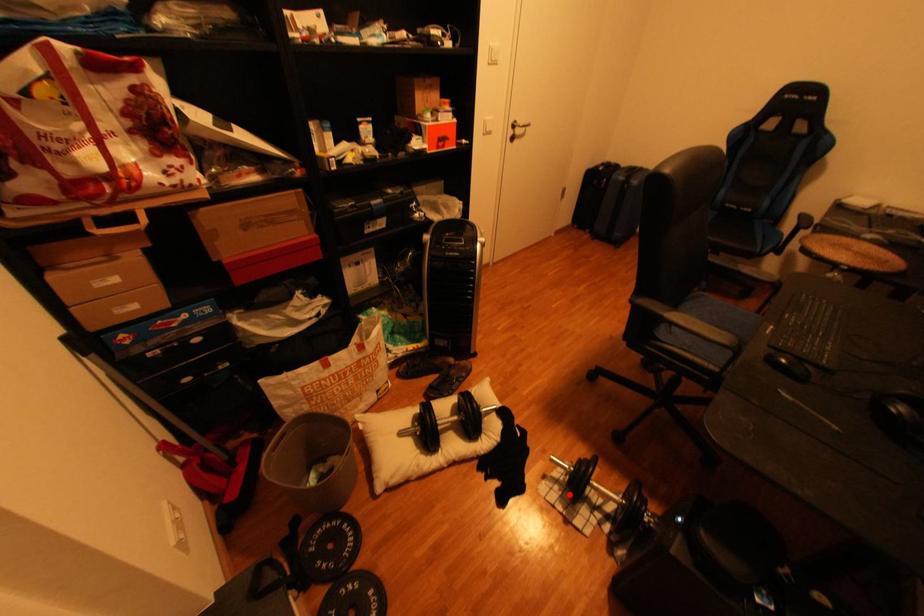
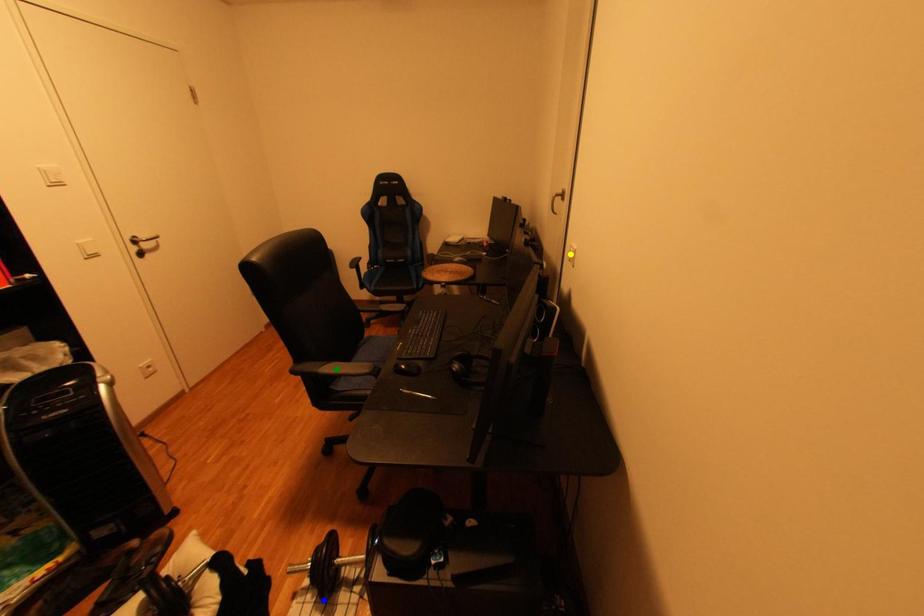
Question: I am providing you with two images of the same scene from different viewpoints. A red point is marked on the first image. You are given multiple points on the second image. In image 2, which mark is for the same physical point as the one in image 1?

Choices:
 (A) yellow point
 (B) green point
 (C) blue point

Answer: (C)